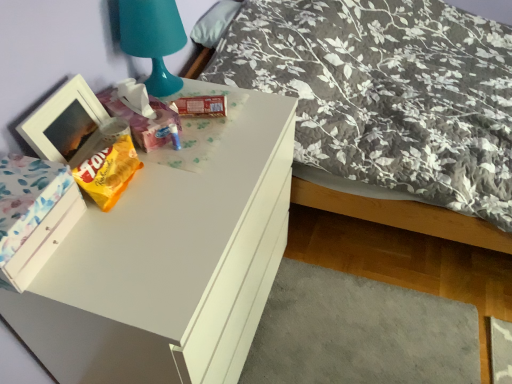
Find the location of a particular element. The width and height of the screenshot is (512, 384). blank space situated above white painted wood drawer at lower left (from a real-world perspective) is located at coordinates (20, 190).